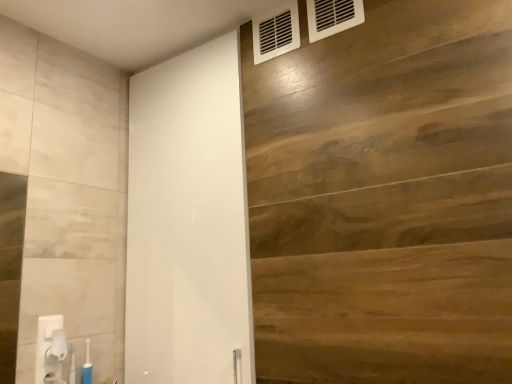
Question: Does white plastic vent at upper right, the 2th air conditioning viewed from the right, lie behind wooden panel at upper right?

Choices:
 (A) yes
 (B) no

Answer: (A)

Question: Is white plastic vent at upper right, which is the 2th air conditioning from front to back, in contact with wooden panel at upper right?

Choices:
 (A) no
 (B) yes

Answer: (A)

Question: Does white plastic vent at upper right, the 1th air conditioning when ordered from back to front, have a lesser width compared to wooden panel at upper right?

Choices:
 (A) no
 (B) yes

Answer: (B)

Question: Is white plastic vent at upper right, placed as the 1th air conditioning when sorted from left to right, not within wooden panel at upper right?

Choices:
 (A) no
 (B) yes

Answer: (A)

Question: From a real-world perspective, is white plastic vent at upper right, placed as the 1th air conditioning when sorted from left to right, physically below wooden panel at upper right?

Choices:
 (A) yes
 (B) no

Answer: (B)

Question: Is white plastic vent at upper right, the 2th air conditioning viewed from the right, wider than wooden panel at upper right?

Choices:
 (A) no
 (B) yes

Answer: (A)

Question: Considering the relative sizes of white glossy barn door at center and white plastic air conditioning at upper right, which appears as the first air conditioning when viewed from the front, in the image provided, is white glossy barn door at center thinner than white plastic air conditioning at upper right, which appears as the first air conditioning when viewed from the front,?

Choices:
 (A) no
 (B) yes

Answer: (A)

Question: Would you say white glossy barn door at center is a long distance from white plastic air conditioning at upper right, the first air conditioning positioned from the right?

Choices:
 (A) yes
 (B) no

Answer: (B)

Question: Is the depth of white glossy barn door at center less than that of white plastic air conditioning at upper right, which appears as the first air conditioning when viewed from the front?

Choices:
 (A) yes
 (B) no

Answer: (A)

Question: Does white glossy barn door at center have a greater height compared to white plastic air conditioning at upper right, which appears as the first air conditioning when viewed from the front?

Choices:
 (A) yes
 (B) no

Answer: (A)

Question: Is white glossy barn door at center positioned with its back to white plastic air conditioning at upper right, which is counted as the 2th air conditioning, starting from the back?

Choices:
 (A) yes
 (B) no

Answer: (B)

Question: Is white glossy barn door at center aimed at white plastic air conditioning at upper right, the first air conditioning positioned from the right?

Choices:
 (A) no
 (B) yes

Answer: (A)

Question: From a real-world perspective, is white glossy barn door at center on top of white plastic vent at upper right, the 2th air conditioning viewed from the right?

Choices:
 (A) yes
 (B) no

Answer: (B)